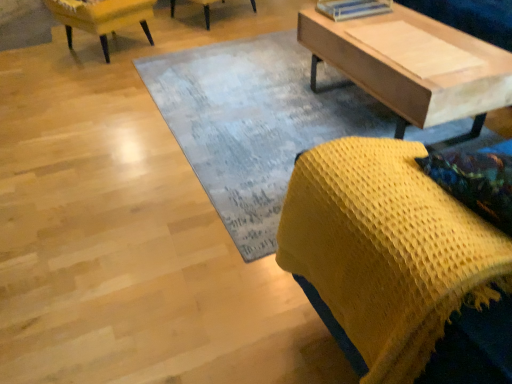
Question: From the image's perspective, is textured gray rug at center positioned above or below yellow fabric chair at upper left, the second chair viewed from the right?

Choices:
 (A) above
 (B) below

Answer: (B)

Question: Would you say textured gray rug at center is inside or outside yellow fabric chair at upper left, the first chair from the left?

Choices:
 (A) outside
 (B) inside

Answer: (A)

Question: Which is nearer to the light wood coffee table at upper right?

Choices:
 (A) yellow fabric chair at upper left, which is the second chair in front-to-back order
 (B) yellow knitted blanket at lower right, which appears as the 2th chair when viewed from the left
 (C) textured gray rug at center
 (D) light brown wood plank at upper right

Answer: (D)

Question: Estimate the real-world distances between objects in this image. Which object is farther from the textured gray rug at center?

Choices:
 (A) light wood coffee table at upper right
 (B) yellow knitted blanket at lower right, which appears as the 2th chair when viewed from the left
 (C) yellow fabric chair at upper left, marked as the 2th chair in a bottom-to-top arrangement
 (D) light brown wood plank at upper right

Answer: (B)